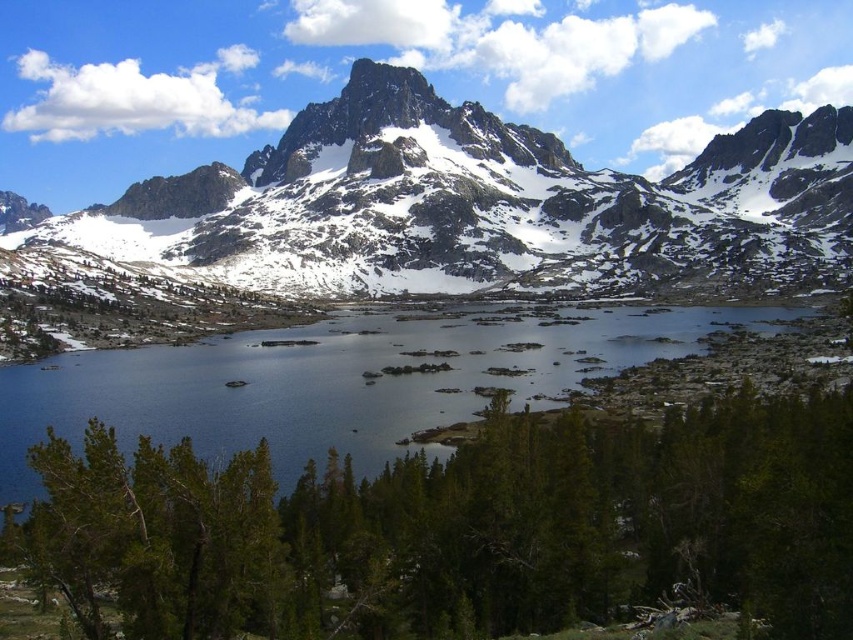
Does snowy granite mountain range at upper center lie behind snowy granite peak at upper center?

No, it is in front of snowy granite peak at upper center.

Find the location of a particular element. snowy granite mountain range at upper center is located at coordinates click(479, 205).

Identify the location of snowy granite mountain range at upper center. (479, 205).

Can you confirm if clear water at center is positioned above snowy granite peak at upper center?

No.

Who is more forward, (370, 451) or (376, 115)?

Point (370, 451)

This screenshot has width=853, height=640. Identify the location of clear water at center. (337, 381).

Is snowy granite mountain range at upper center bigger than clear water at center?

Indeed, snowy granite mountain range at upper center has a larger size compared to clear water at center.

Who is positioned more to the right, snowy granite mountain range at upper center or clear water at center?

Positioned to the right is snowy granite mountain range at upper center.

Is point (317, 221) positioned after point (231, 369)?

That is True.

I want to click on snowy granite mountain range at upper center, so click(x=479, y=205).